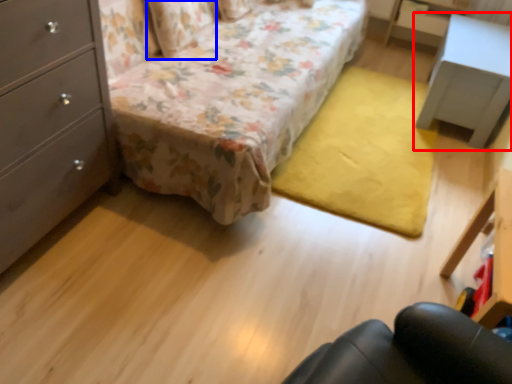
Question: Which of the following is the closest to the observer, nightstand (highlighted by a red box) or pillow (highlighted by a blue box)?

Choices:
 (A) nightstand
 (B) pillow

Answer: (B)